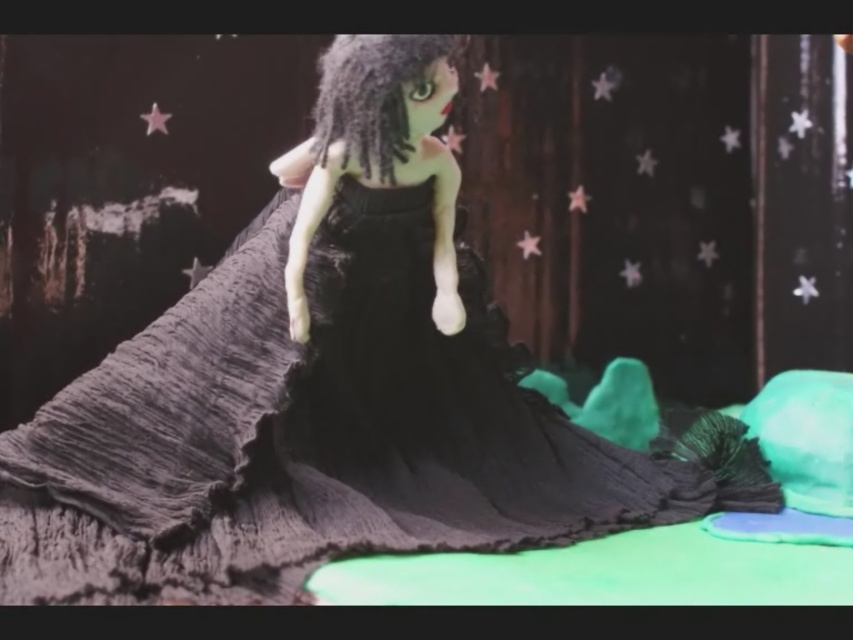
You are an artist analyzing the composition of the image. The matte black dress at center is positioned at a specific coordinate. Can you determine if the dress is placed closer to the top or bottom of the image based on its coordinate?

The 2D location of the matte black dress at center is at point (427, 356). Since the y coordinate is 0.502, which is slightly above the center point of 0.5, the dress is positioned closer to the bottom of the image.

You are a fashion designer observing the doll figure. You need to determine if the matte black dress at center can be folded and stored in a box designed for the satin black hair at center. Based on their sizes, what do you think?

The matte black dress at center is wider than the satin black hair at center, so it cannot be folded and stored in a box designed for the satin black hair at center due to its larger width.

In the scene shown: Where is the black crinkled fabric dress at center located in the image?

The black crinkled fabric dress at center is located at point [321,433].